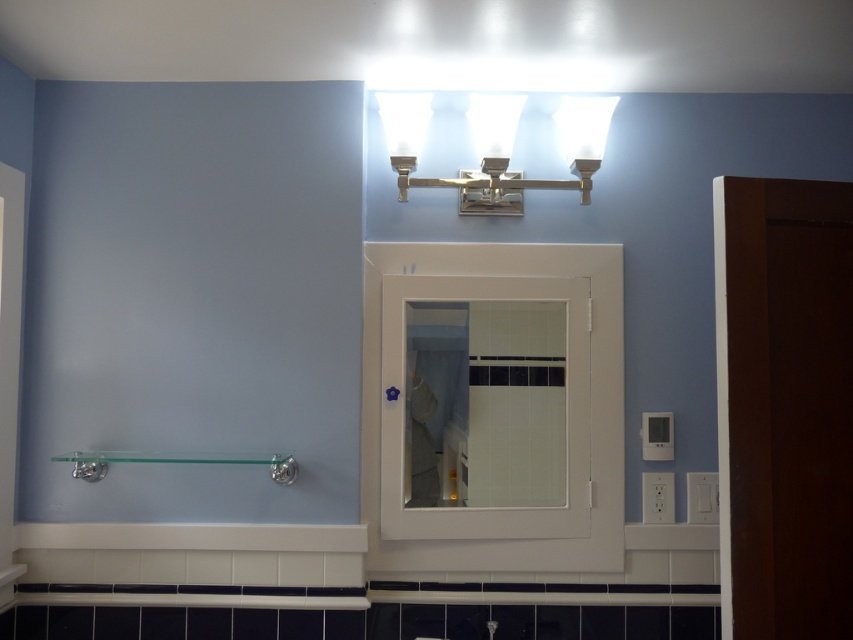
Is point (437, 502) less distant than point (602, 138)?

That is False.

Between point (480, 493) and point (404, 154), which one is positioned behind?

Point (480, 493)

Is point (428, 429) closer to viewer compared to point (578, 156)?

That is False.

What are the coordinates of `clear glass mirror at center` in the screenshot? It's located at (485, 403).

Can you confirm if white matte medicine cabinet at center is positioned above clear glass mirror at center?

No, white matte medicine cabinet at center is not above clear glass mirror at center.

Who is lower down, white matte medicine cabinet at center or clear glass mirror at center?

Positioned lower is white matte medicine cabinet at center.

Which is in front, point (473, 480) or point (450, 467)?

Point (473, 480) is more forward.

I want to click on white matte medicine cabinet at center, so click(492, 406).

Does polished brass light fixture at upper center have a lesser height compared to matte silver faucet at lower center?

In fact, polished brass light fixture at upper center may be taller than matte silver faucet at lower center.

Does polished brass light fixture at upper center have a lesser width compared to matte silver faucet at lower center?

Incorrect, polished brass light fixture at upper center's width is not less than matte silver faucet at lower center's.

Measure the distance between point (x=573, y=106) and camera.

Point (x=573, y=106) is 7.04 feet away from camera.

I want to click on polished brass light fixture at upper center, so click(496, 147).